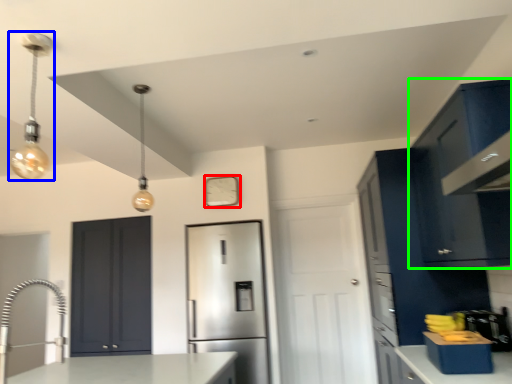
Question: Based on their relative distances, which object is farther from clock (highlighted by a red box)? Choose from light fixture (highlighted by a blue box) and cabinetry (highlighted by a green box).

Choices:
 (A) light fixture
 (B) cabinetry

Answer: (B)